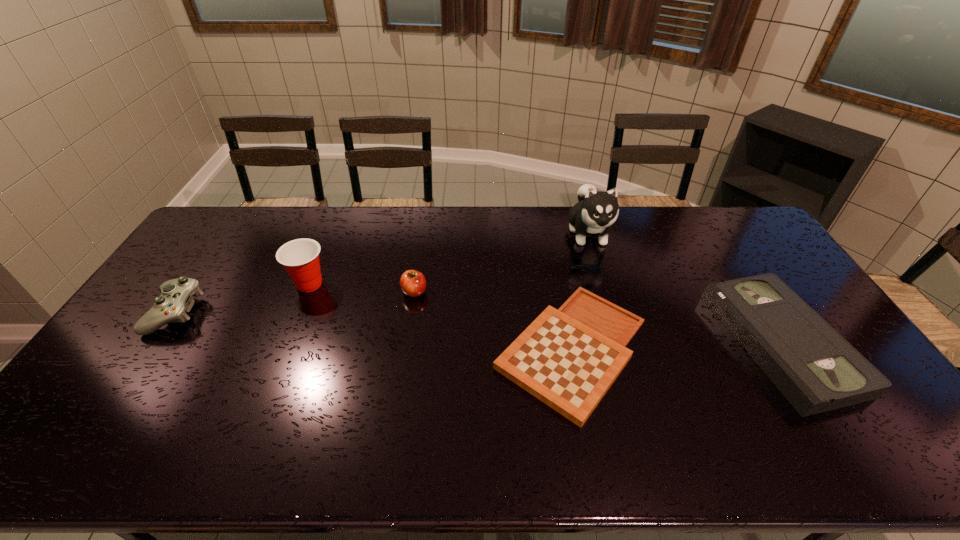
Where is `free point at the left edge`? The width and height of the screenshot is (960, 540). free point at the left edge is located at coordinates (207, 259).

Find the location of a particular element. The image size is (960, 540). free region at the far left corner of the desktop is located at coordinates (248, 217).

Find the location of a particular element. Image resolution: width=960 pixels, height=540 pixels. free point between the videotape and the gameboard is located at coordinates (677, 347).

Image resolution: width=960 pixels, height=540 pixels. In order to click on free space between the farthest object and the rightmost object in this screenshot , I will do `click(684, 288)`.

The width and height of the screenshot is (960, 540). Find the location of `free space between the control and the fourth object from right to left`. free space between the control and the fourth object from right to left is located at coordinates (295, 302).

What are the coordinates of `vacant space that's between the cup and the gameboard` in the screenshot? It's located at (441, 317).

Find the location of `free point between the puppy and the fourth object from right to left`. free point between the puppy and the fourth object from right to left is located at coordinates (501, 262).

Locate an element on the screen. This screenshot has height=540, width=960. empty space that is in between the shortest object and the control is located at coordinates (373, 331).

Where is `unoccupied area between the leftmost object and the farthest object`? This screenshot has height=540, width=960. unoccupied area between the leftmost object and the farthest object is located at coordinates (382, 273).

Identify which object is the third nearest to the control. Please provide its 2D coordinates. Your answer should be formatted as a tuple, i.e. [(x, y)], where the tuple contains the x and y coordinates of a point satisfying the conditions above.

[(568, 358)]